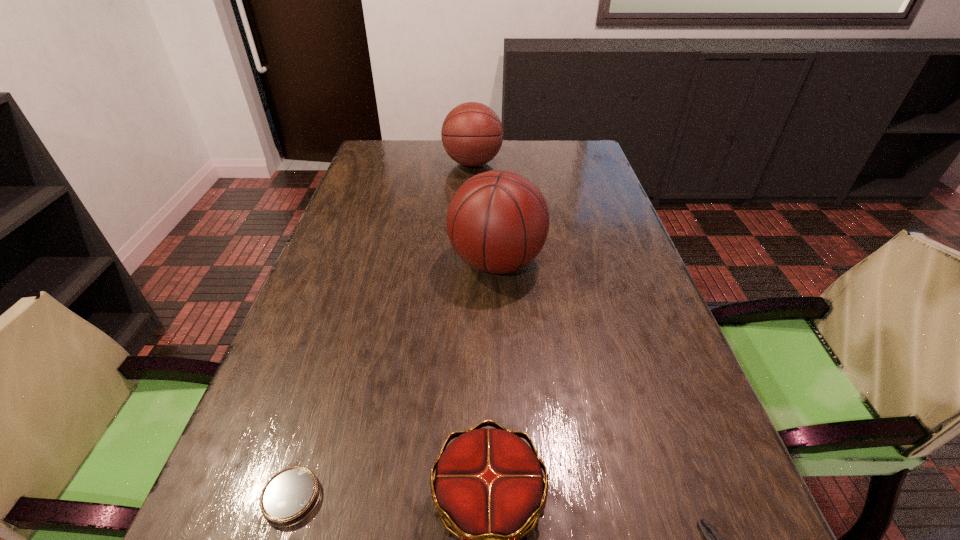
Image resolution: width=960 pixels, height=540 pixels. I want to click on the nearer basketball, so click(x=498, y=221).

At what (x,y) coordinates should I click in order to perform the action: click on the second tallest object. Please return your answer as a coordinate pair (x, y). Looking at the image, I should click on (472, 134).

Locate an element on the screen. This screenshot has width=960, height=540. the farther basketball is located at coordinates (472, 134).

The height and width of the screenshot is (540, 960). I want to click on the second shortest object, so click(290, 496).

Locate an element on the screen. the leftmost object is located at coordinates (290, 496).

The height and width of the screenshot is (540, 960). Identify the location of free space located on the right of the nearer basketball. (588, 262).

This screenshot has height=540, width=960. I want to click on free region located on the right of the farther basketball, so click(x=582, y=164).

The height and width of the screenshot is (540, 960). In order to click on blank space located on the back of the compass in this screenshot , I will do `click(334, 360)`.

At what (x,y) coordinates should I click in order to perform the action: click on object present at the far edge. Please return your answer as a coordinate pair (x, y). The height and width of the screenshot is (540, 960). Looking at the image, I should click on (472, 134).

Locate an element on the screen. object present at the left edge is located at coordinates (290, 496).